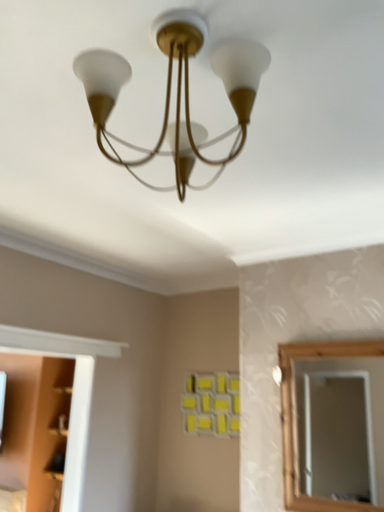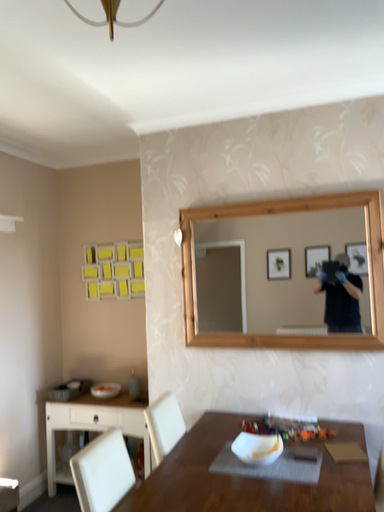
Question: How did the camera likely rotate when shooting the video?

Choices:
 (A) rotated downward
 (B) rotated upward

Answer: (A)